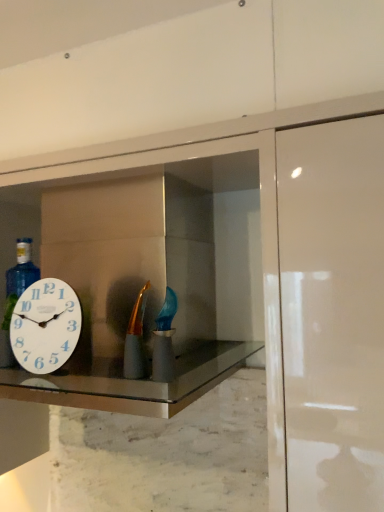
Image resolution: width=384 pixels, height=512 pixels. What are the coordinates of `free spot behind white glossy clock at left` in the screenshot? It's located at (74, 368).